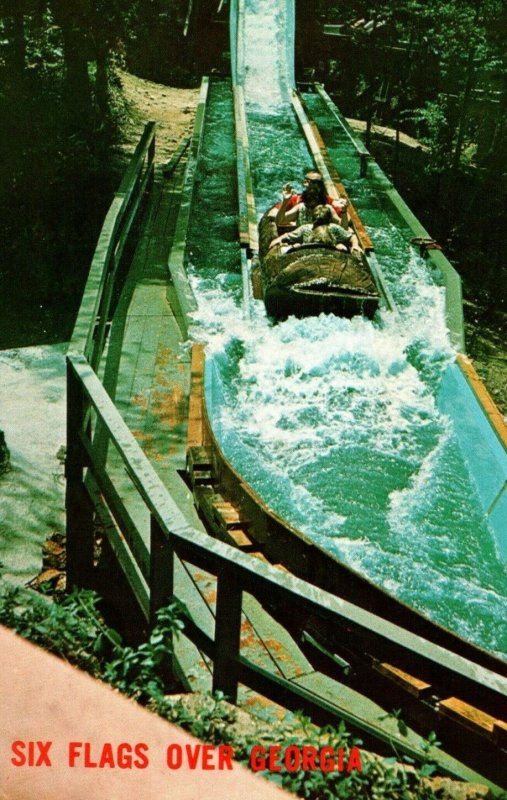
The height and width of the screenshot is (800, 507). Find the location of `hand rails`. hand rails is located at coordinates (128, 450), (263, 569), (107, 226).